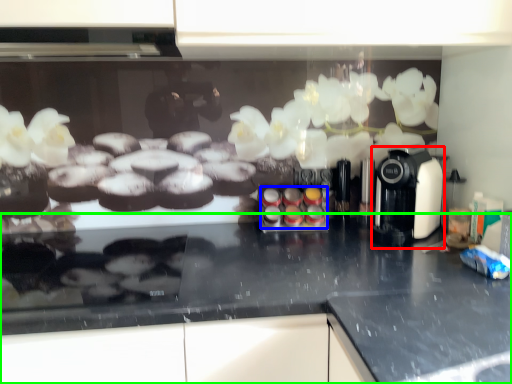
Question: Estimate the real-world distances between objects in this image. Which object is farther from coffee machine (highlighted by a red box), food (highlighted by a blue box) or countertop (highlighted by a green box)?

Choices:
 (A) food
 (B) countertop

Answer: (B)